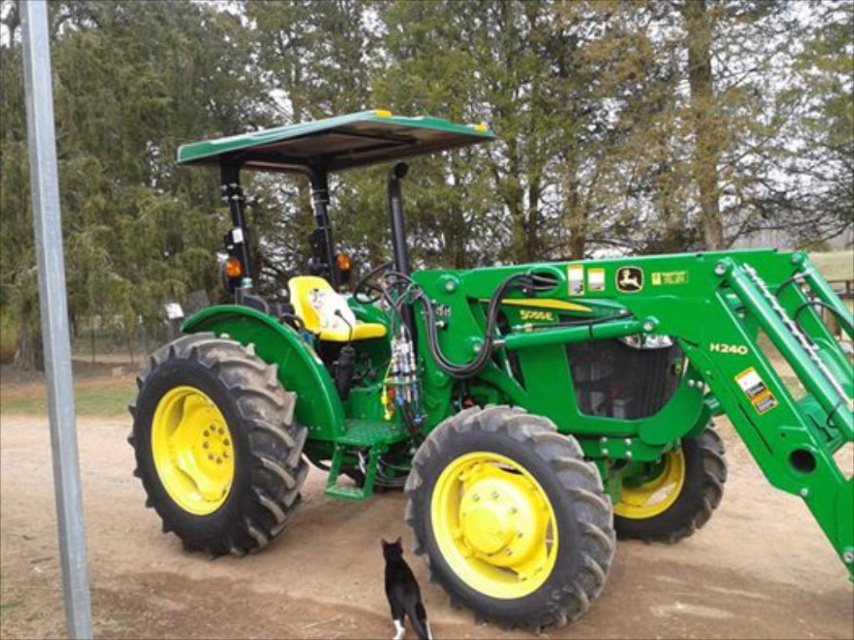
Question: Which object is positioned closest to the black fur cat at lower center?

Choices:
 (A) green matte tractor at center
 (B) dirt track at lower center

Answer: (A)

Question: Is green matte tractor at center to the left of black fur cat at lower center from the viewer's perspective?

Choices:
 (A) no
 (B) yes

Answer: (A)

Question: Is dirt track at lower center smaller than black fur cat at lower center?

Choices:
 (A) no
 (B) yes

Answer: (B)

Question: Among these points, which one is farthest from the camera?

Choices:
 (A) coord(632,515)
 (B) coord(399,561)

Answer: (A)

Question: Does green matte tractor at center appear on the left side of dirt track at lower center?

Choices:
 (A) no
 (B) yes

Answer: (B)

Question: Which object appears farthest from the camera in this image?

Choices:
 (A) green matte tractor at center
 (B) dirt track at lower center
 (C) black fur cat at lower center

Answer: (B)